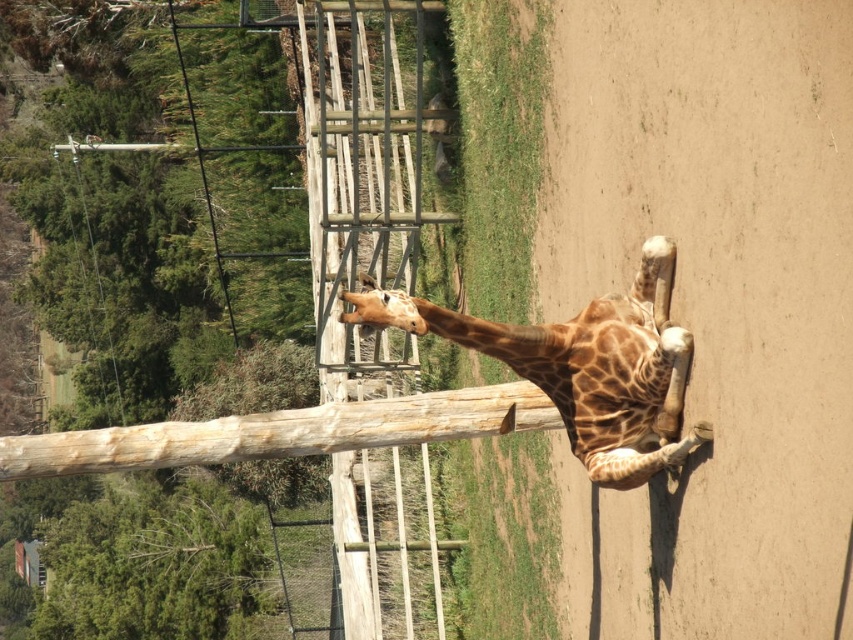
Question: Among these objects, which one is farthest from the camera?

Choices:
 (A) spotted fur giraffe at center
 (B) spotted fur giraffe head at center

Answer: (B)

Question: Is spotted fur giraffe at center bigger than spotted fur giraffe head at center?

Choices:
 (A) yes
 (B) no

Answer: (A)

Question: Does spotted fur giraffe at center come in front of spotted fur giraffe head at center?

Choices:
 (A) no
 (B) yes

Answer: (B)

Question: Is spotted fur giraffe at center closer to camera compared to spotted fur giraffe head at center?

Choices:
 (A) no
 (B) yes

Answer: (B)